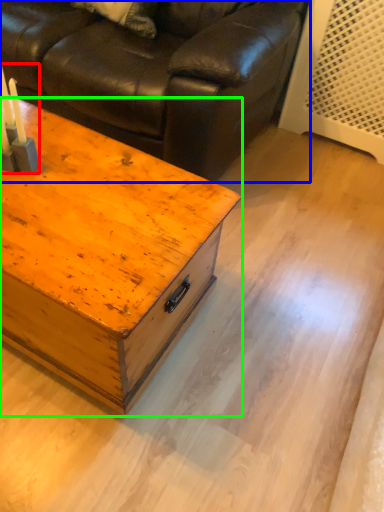
Question: Which is nearer to the candle holder (highlighted by a red box)? studio couch (highlighted by a blue box) or table (highlighted by a green box).

Choices:
 (A) studio couch
 (B) table

Answer: (B)